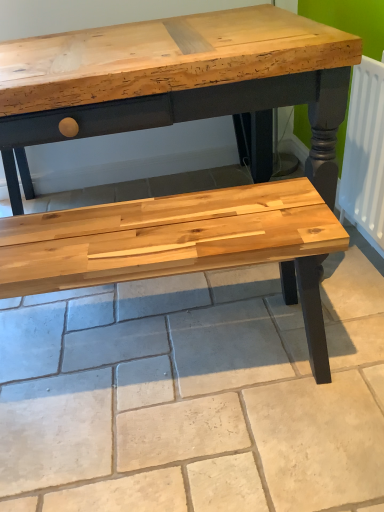
The image size is (384, 512). What do you see at coordinates (365, 154) in the screenshot?
I see `white matte radiator at right` at bounding box center [365, 154].

The height and width of the screenshot is (512, 384). I want to click on white matte radiator at right, so click(365, 154).

What is the approximate width of white matte radiator at right?

It is 4.92 inches.

The image size is (384, 512). Describe the element at coordinates (193, 396) in the screenshot. I see `natural wood bench at center` at that location.

Find the location of a particular element. This screenshot has height=512, width=384. natural wood bench at center is located at coordinates [x=193, y=396].

The width and height of the screenshot is (384, 512). I want to click on white matte radiator at right, so click(365, 154).

Considering the relative positions of natural wood bench at center and white matte radiator at right in the image provided, is natural wood bench at center to the left of white matte radiator at right from the viewer's perspective?

Yes.

Which object is closer to the camera taking this photo, natural wood bench at center or white matte radiator at right?

natural wood bench at center is more forward.

Considering the positions of point (51, 507) and point (357, 125), is point (51, 507) closer or farther from the camera than point (357, 125)?

Point (51, 507) is closer to the camera than point (357, 125).

From the image's perspective, which one is positioned higher, natural wood bench at center or white matte radiator at right?

white matte radiator at right is shown above in the image.

From a real-world perspective, is natural wood bench at center over white matte radiator at right?

Incorrect, from a real-world perspective, natural wood bench at center is lower than white matte radiator at right.

Which object is thinner, natural wood bench at center or white matte radiator at right?

white matte radiator at right is thinner.

Between natural wood bench at center and white matte radiator at right, which one has less height?

Standing shorter between the two is natural wood bench at center.

Considering the relative sizes of natural wood bench at center and white matte radiator at right in the image provided, is natural wood bench at center bigger than white matte radiator at right?

Yes.

Would you say natural wood bench at center contains white matte radiator at right?

No, white matte radiator at right is located outside of natural wood bench at center.

Would you consider natural wood bench at center to be distant from white matte radiator at right?

No, natural wood bench at center is not far from white matte radiator at right.

Is natural wood bench at center turned away from white matte radiator at right?

No, natural wood bench at center is not facing the opposite direction of white matte radiator at right.

From the picture: How many degrees apart are the facing directions of natural wood bench at center and white matte radiator at right?

89.3 degrees.

How far apart are natural wood bench at center and white matte radiator at right?

natural wood bench at center and white matte radiator at right are 24.74 inches apart.

You are a GUI agent. You are given a task and a screenshot of the screen. Output one action in this format:
    pyautogui.click(x=<x>, y=<y>)
    Task: Click on the radiator above the natural wood bench at center (from the image's perspective)
    
    Given the screenshot: What is the action you would take?
    pos(365,154)

Considering the positions of objects white matte radiator at right and natural wood bench at center in the image provided, who is more to the right, white matte radiator at right or natural wood bench at center?

white matte radiator at right is more to the right.

Is white matte radiator at right closer to the viewer compared to natural wood bench at center?

No, white matte radiator at right is behind natural wood bench at center.

Is point (379, 136) positioned behind point (183, 328)?

That is False.

From the image's perspective, which one is positioned higher, white matte radiator at right or natural wood bench at center?

white matte radiator at right is shown above in the image.

From a real-world perspective, is white matte radiator at right above or below natural wood bench at center?

white matte radiator at right is above natural wood bench at center.

Considering the relative sizes of white matte radiator at right and natural wood bench at center in the image provided, is white matte radiator at right wider than natural wood bench at center?

In fact, white matte radiator at right might be narrower than natural wood bench at center.

Who is taller, white matte radiator at right or natural wood bench at center?

white matte radiator at right.

Considering the sizes of objects white matte radiator at right and natural wood bench at center in the image provided, who is smaller, white matte radiator at right or natural wood bench at center?

white matte radiator at right is smaller.

Is white matte radiator at right spatially inside natural wood bench at center, or outside of it?

white matte radiator at right exists outside the volume of natural wood bench at center.

Are white matte radiator at right and natural wood bench at center located far from each other?

Actually, white matte radiator at right and natural wood bench at center are a little close together.

In the scene shown: Is white matte radiator at right oriented towards natural wood bench at center?

Yes.

You are a GUI agent. You are given a task and a screenshot of the screen. Output one action in this format:
    pyautogui.click(x=<x>, y=<y>)
    Task: Click on the radiator located behind the natural wood bench at center
    
    Given the screenshot: What is the action you would take?
    click(x=365, y=154)

This screenshot has width=384, height=512. What are the coordinates of `tile on the left of the white matte radiator at right` in the screenshot? It's located at (193, 396).

Locate an element on the screen. The image size is (384, 512). radiator that appears above the natural wood bench at center (from a real-world perspective) is located at coordinates (365, 154).